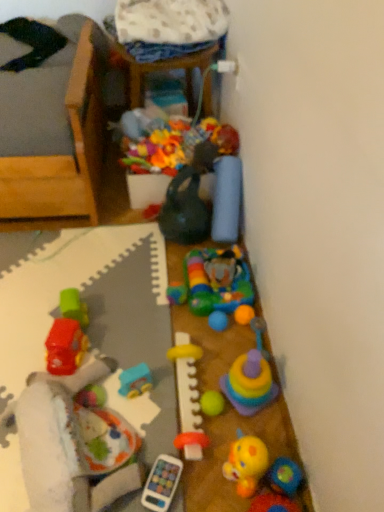
The height and width of the screenshot is (512, 384). Identify the location of vacant space behind yellow rubber teething ring at center, the 4th toy from the left. (177, 334).